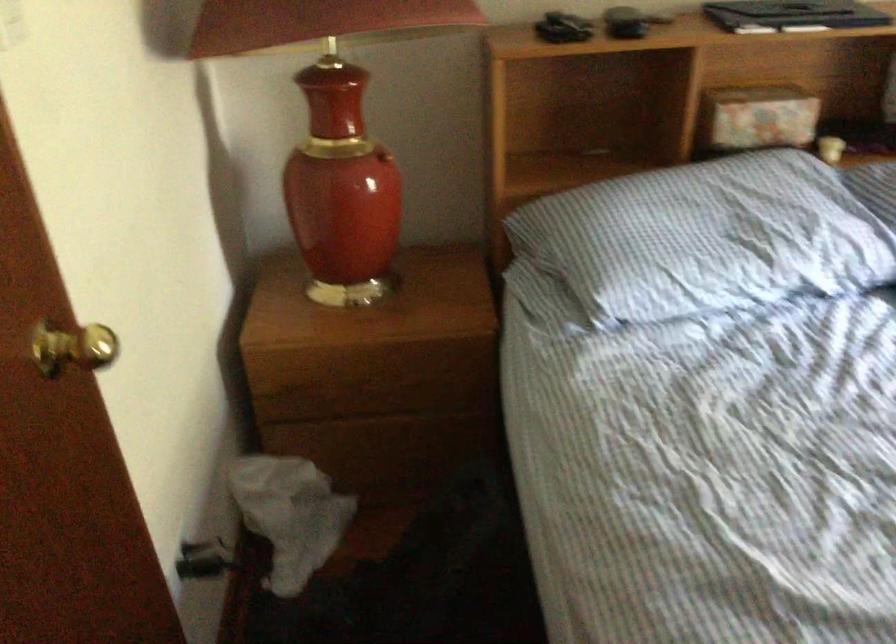
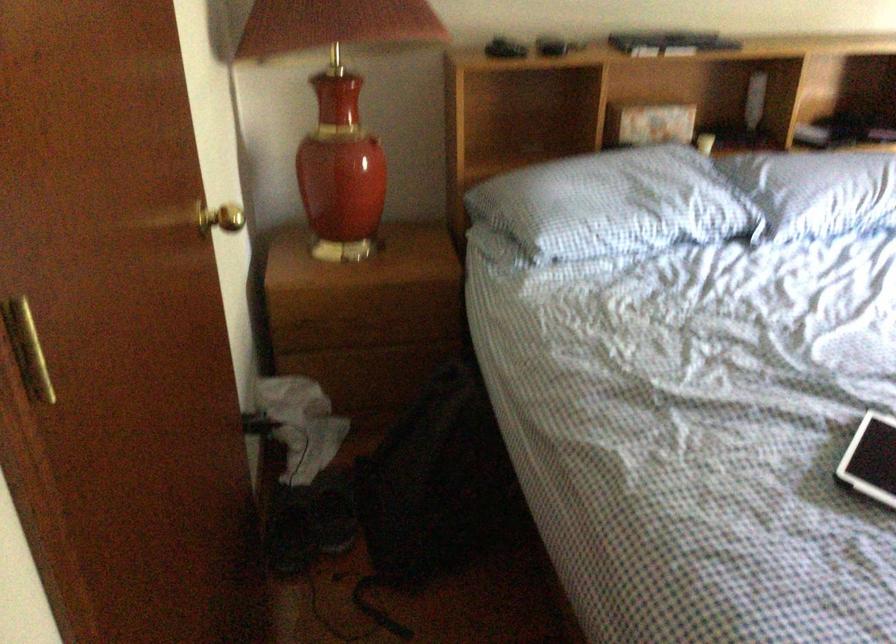
The point at (703, 243) is marked in the first image. Where is the corresponding point in the second image?

(613, 204)